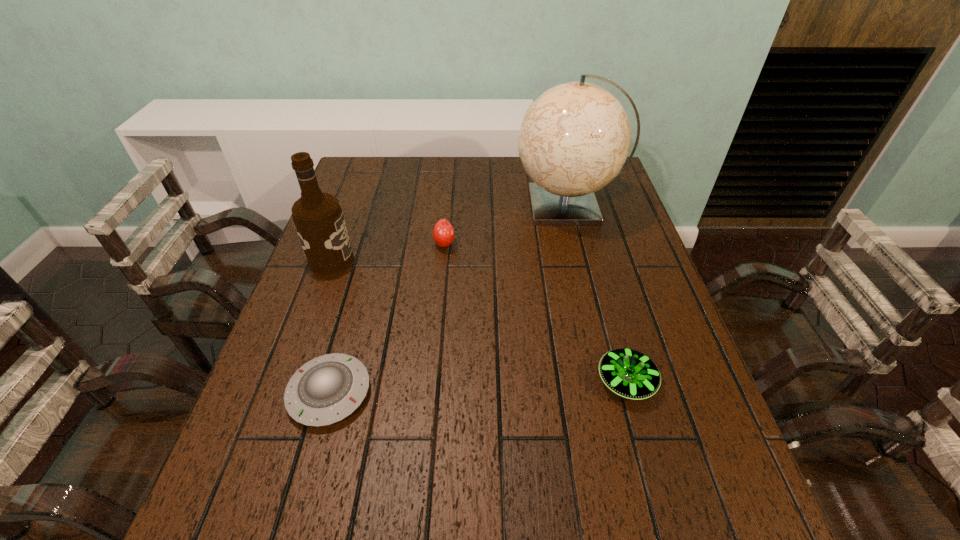
Find the location of a particular element. the tallest object is located at coordinates (575, 137).

Find the location of a particular element. This screenshot has height=540, width=960. alcohol is located at coordinates (318, 218).

The image size is (960, 540). In order to click on the third tallest object in this screenshot , I will do `click(443, 233)`.

Locate an element on the screen. The width and height of the screenshot is (960, 540). apple is located at coordinates (443, 233).

Identify the location of the right saucer. Image resolution: width=960 pixels, height=540 pixels. (629, 373).

Find the location of `the second shortest object`. the second shortest object is located at coordinates (629, 373).

This screenshot has height=540, width=960. What are the coordinates of `the shorter saucer` in the screenshot? It's located at (325, 390).

You are a GUI agent. You are given a task and a screenshot of the screen. Output one action in this format:
    pyautogui.click(x=<x>, y=<y>)
    Task: Click on the shortest object
    The image size is (960, 540).
    Given the screenshot: What is the action you would take?
    pyautogui.click(x=325, y=390)

Locate an element on the screen. This screenshot has height=540, width=960. vacant space located on the surface of the globe showing Europe and Africa is located at coordinates (402, 206).

This screenshot has width=960, height=540. I want to click on free space located on the surface of the globe showing Europe and Africa, so click(x=396, y=206).